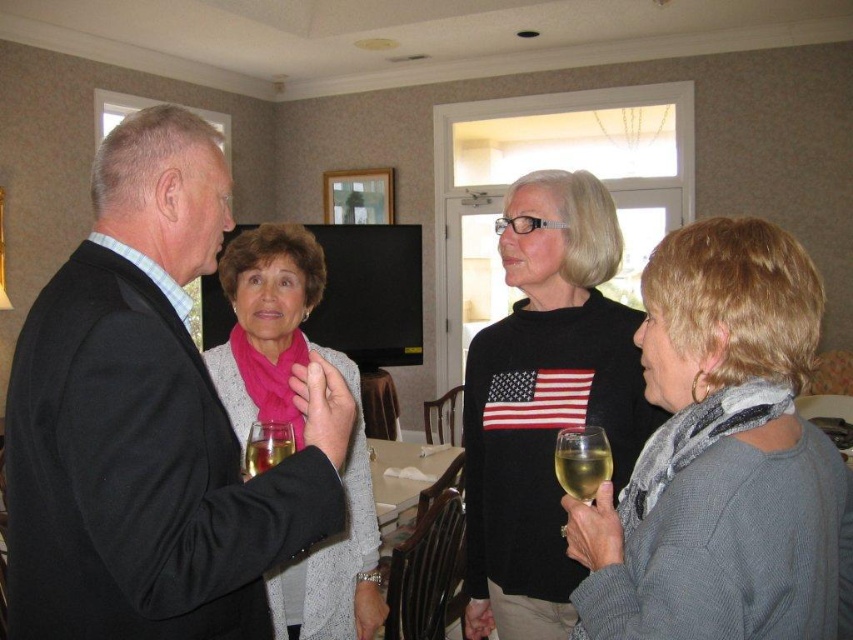
Who is higher up, gray knitted sweater at lower right or black sweater at center?

gray knitted sweater at lower right

This screenshot has height=640, width=853. What do you see at coordinates (722, 458) in the screenshot?
I see `gray knitted sweater at lower right` at bounding box center [722, 458].

The width and height of the screenshot is (853, 640). Find the location of `gray knitted sweater at lower right`. gray knitted sweater at lower right is located at coordinates (722, 458).

Is point (115, 128) less distant than point (251, 470)?

Yes, it is in front of point (251, 470).

Does black suit at left have a greater width compared to translucent glass at center?

Yes.

In order to click on black suit at left in this screenshot , I will do `click(149, 420)`.

Does pink scarf at center appear on the right side of translucent glass at center?

Incorrect, pink scarf at center is not on the right side of translucent glass at center.

Which is above, pink scarf at center or translucent glass at center?

translucent glass at center is higher up.

Find the location of a particular element. The height and width of the screenshot is (640, 853). pink scarf at center is located at coordinates (296, 422).